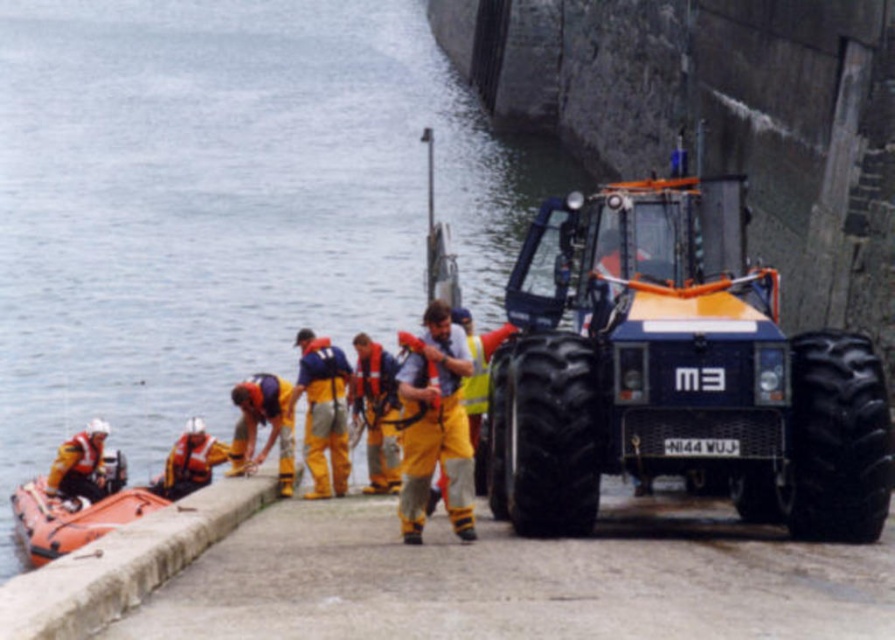
Is orange reflective jacket at center positioned behind orange life vest at left?

No, orange reflective jacket at center is in front of orange life vest at left.

Who is lower down, orange reflective jacket at center or orange life vest at left?

orange life vest at left is lower down.

Is point (277, 380) positioned behind point (206, 481)?

No, (277, 380) is closer to viewer.

This screenshot has width=895, height=640. Identify the location of orange reflective jacket at center. (263, 424).

Who is taller, orange reflective jacket at center or orange life vest at lower left?

orange reflective jacket at center

Does point (243, 387) lie behind point (47, 490)?

No, it is in front of (47, 490).

The width and height of the screenshot is (895, 640). What do you see at coordinates (263, 424) in the screenshot?
I see `orange reflective jacket at center` at bounding box center [263, 424].

Locate an element on the screen. This screenshot has width=895, height=640. orange reflective jacket at center is located at coordinates (263, 424).

Who is lower down, yellow waterproof suit at center or orange rubber boat at lower left?

orange rubber boat at lower left is below.

Between yellow waterproof suit at center and orange rubber boat at lower left, which one appears on the left side from the viewer's perspective?

orange rubber boat at lower left

The height and width of the screenshot is (640, 895). I want to click on yellow waterproof suit at center, so click(x=435, y=426).